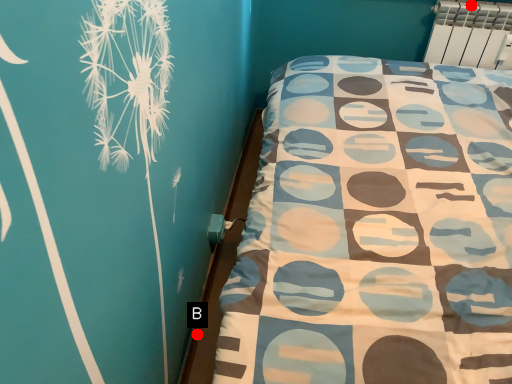
Question: Two points are circled on the image, labeled by A and B beside each circle. Which point is farther to the camera?

Choices:
 (A) A is further
 (B) B is further

Answer: (A)